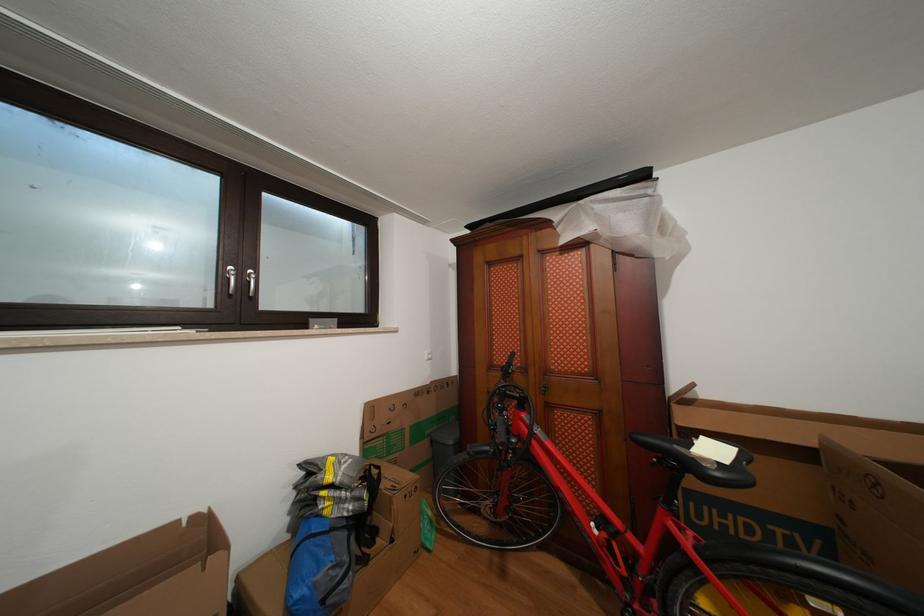
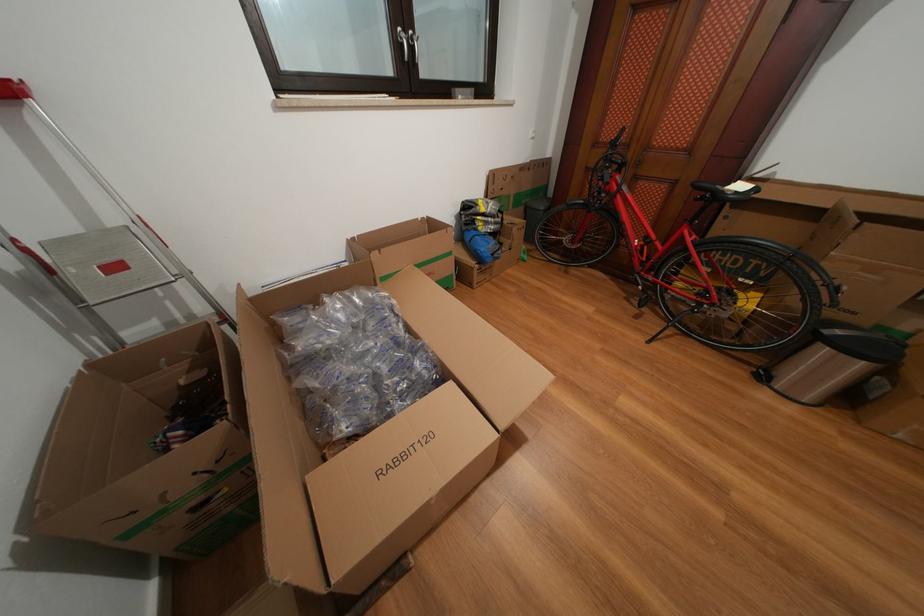
In the second image, find the point that corresponds to point 238,273 in the first image.

(407, 34)